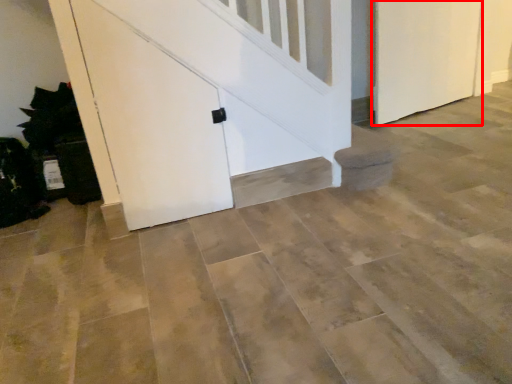
Question: From the image, what is the correct spatial relationship of door (annotated by the red box) in relation to door?

Choices:
 (A) right
 (B) left

Answer: (A)